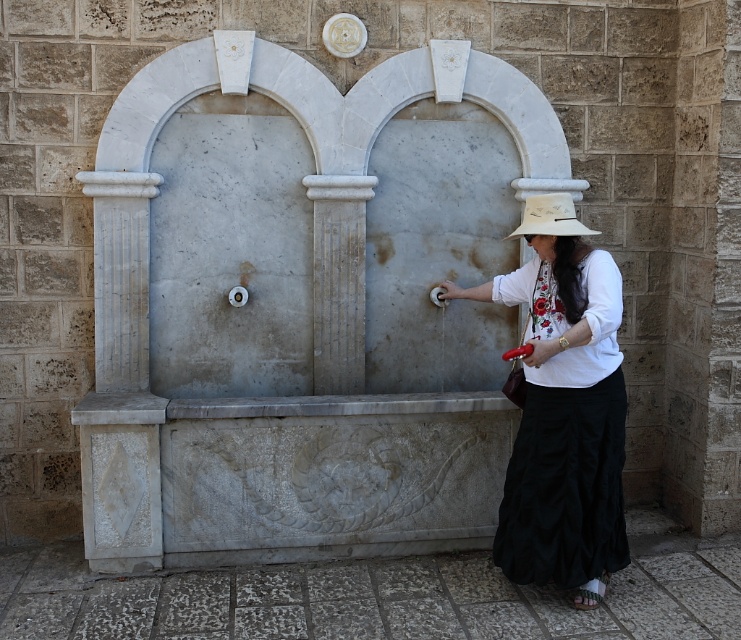
You are standing 2 meters away from the camera. You want to reach the white cotton shirt at center. Is it possible to reach it without moving?

The white cotton shirt at center is 4.02 meters from the camera. Since you are only 2 meters away from the camera, you are closer to the camera than the shirt. Therefore, you can reach the white cotton shirt at center without moving.

You are a tailor observing the white cotton shirt at center and the white fabric hat at right. Which item requires more fabric to make?

The white cotton shirt at center requires more fabric to make since it is bigger than the white fabric hat at right.